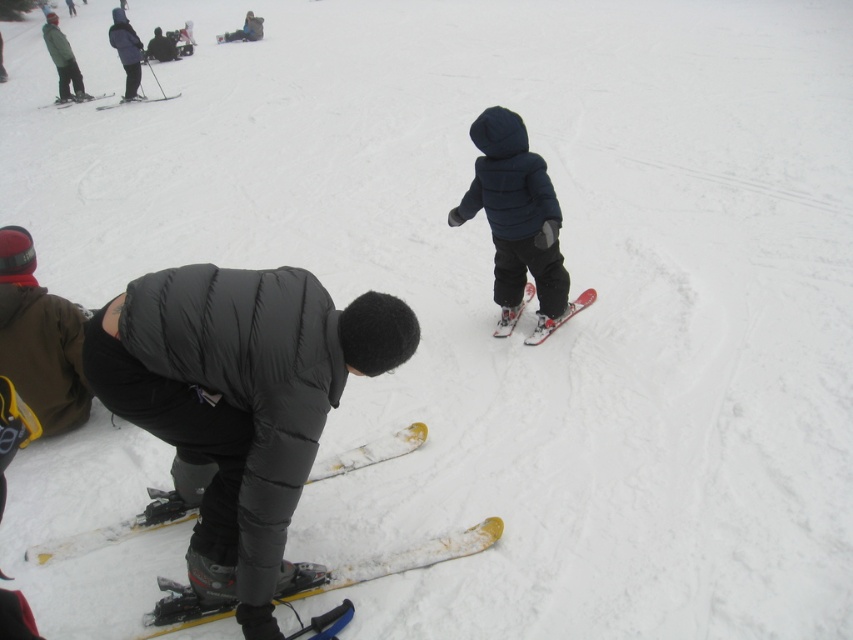
You are planning to take a photo of the dark blue puffy jacket at center and the yellow metallic ski at lower center. Which object should you focus on if you want to capture the wider object in your shot?

The yellow metallic ski at lower center is wider than the dark blue puffy jacket at center, so you should focus on the yellow metallic ski at lower center to capture the wider object.

You are a ski instructor observing a parent and child preparing their skis. The parent is adjusting the yellow metallic ski at lower center while the child holds the red plastic ski at center. Which ski is positioned to the left?

The yellow metallic ski at lower center is positioned to the left of the red plastic ski at center.